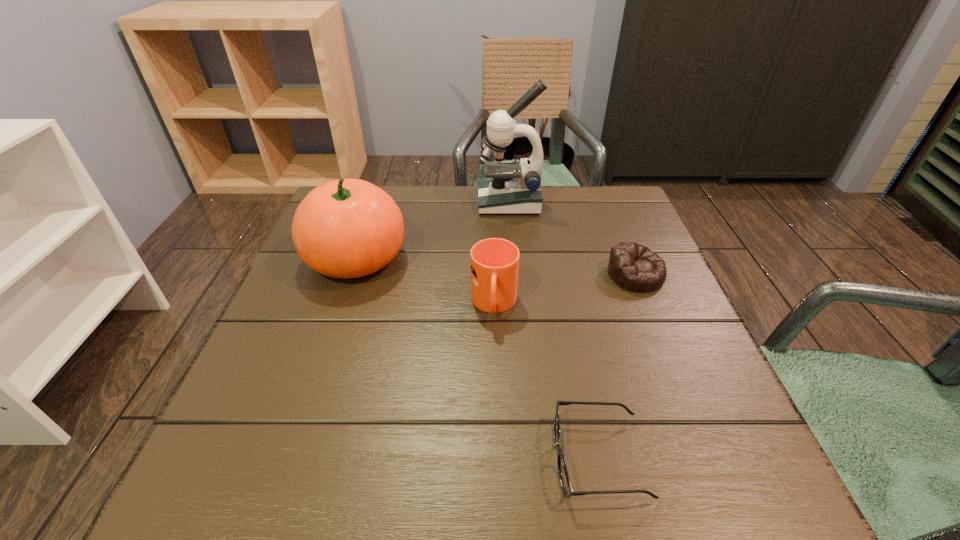
Where is `the farthest object`? The image size is (960, 540). the farthest object is located at coordinates (515, 188).

At what (x,y) coordinates should I click in order to perform the action: click on microscope. Please return your answer as a coordinate pair (x, y). Image resolution: width=960 pixels, height=540 pixels. Looking at the image, I should click on (515, 188).

Locate an element on the screen. The width and height of the screenshot is (960, 540). the second tallest object is located at coordinates (348, 228).

Locate an element on the screen. This screenshot has height=540, width=960. pumpkin is located at coordinates tap(348, 228).

The image size is (960, 540). Identify the location of the third tallest object. (494, 262).

Image resolution: width=960 pixels, height=540 pixels. I want to click on beanbag, so click(636, 268).

Where is `the fourth tallest object`? Image resolution: width=960 pixels, height=540 pixels. the fourth tallest object is located at coordinates (636, 268).

Image resolution: width=960 pixels, height=540 pixels. Identify the location of the shortest object. tap(564, 479).

Identify the location of the nearest object. (564, 479).

Find the location of a particular element. The image size is (960, 540). vacant space located on the left of the farthest object is located at coordinates (443, 202).